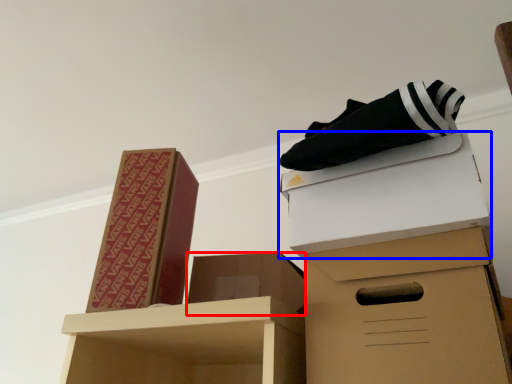
Question: Which object is closer to the camera taking this photo, box (highlighted by a red box) or box (highlighted by a blue box)?

Choices:
 (A) box
 (B) box

Answer: (B)